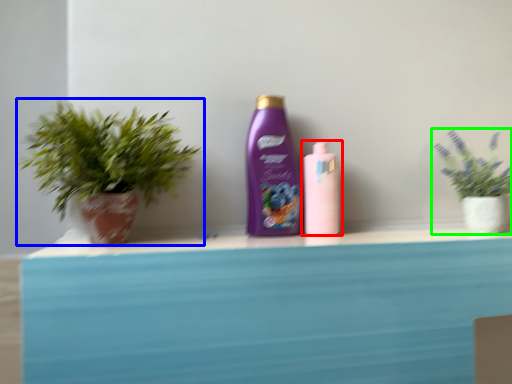
Question: Based on their relative distances, which object is farther from bottle (highlighted by a red box)? Choose from houseplant (highlighted by a blue box) and houseplant (highlighted by a green box).

Choices:
 (A) houseplant
 (B) houseplant

Answer: (A)